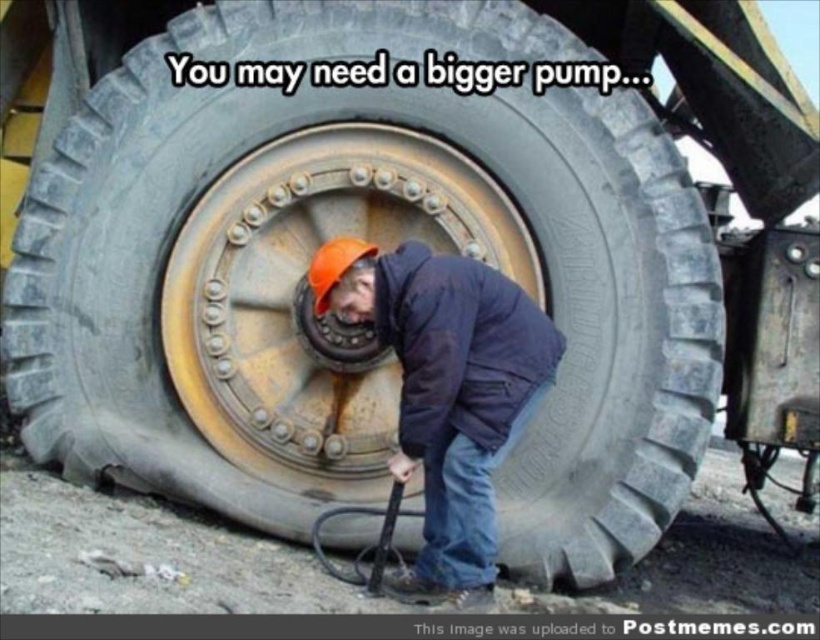
Question: Is rusty metal rim at center closer to camera compared to orange hard hat at center?

Choices:
 (A) yes
 (B) no

Answer: (B)

Question: Is rusty metal rim at center smaller than orange hard hat at center?

Choices:
 (A) yes
 (B) no

Answer: (A)

Question: Does rusty metal rim at center have a larger size compared to orange hard hat at center?

Choices:
 (A) no
 (B) yes

Answer: (A)

Question: Which object is closer to the camera taking this photo?

Choices:
 (A) orange hard hat at center
 (B) rusty metal rim at center

Answer: (A)

Question: Among these objects, which one is nearest to the camera?

Choices:
 (A) rusty metal rim at center
 (B) orange hard hat at center

Answer: (B)